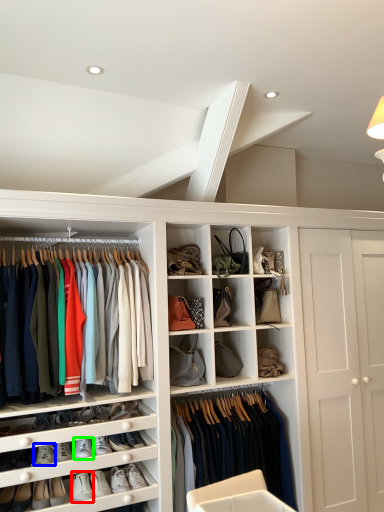
Question: Based on their relative distances, which object is farther from footwear (highlighted by a red box)? Choose from footwear (highlighted by a blue box) and footwear (highlighted by a green box).

Choices:
 (A) footwear
 (B) footwear

Answer: (A)